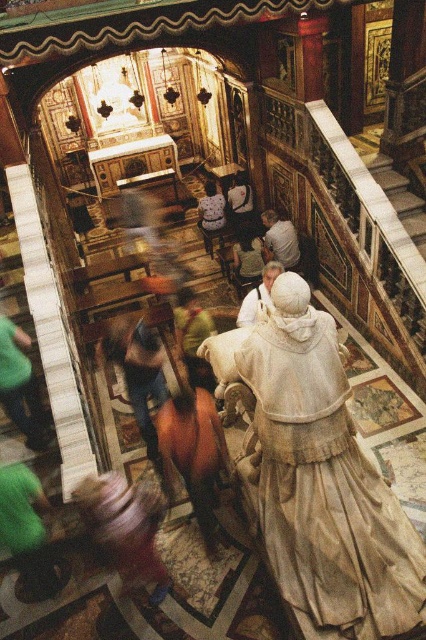
You are standing in the cathedral and want to find the green fabric shirt at left. According to the coordinates given, where should you look relative to your current position?

The green fabric shirt at left is located at coordinates point (20, 387), which means it is positioned to your left and slightly forward from your current position in the cathedral.

You are an interior designer planning to place a decorative item that requires a minimum of 1.2 meters of space between two items. You see the green fabric shirt at center and the light beige fabric dress at center. Can you place the item between them?

The green fabric shirt at center has a larger width than the light beige fabric dress at center. Therefore, the space between them may be sufficient for the decorative item, but the exact distance isn